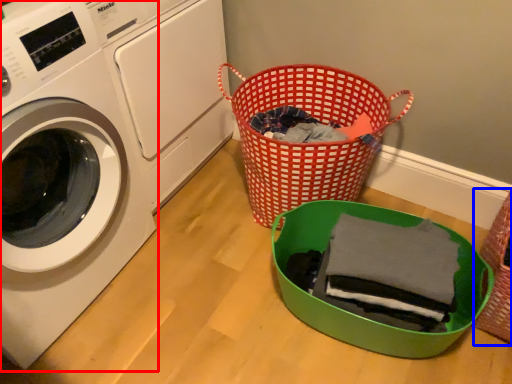
Question: Which object is closer to the camera taking this photo, washing machine (highlighted by a red box) or basket (highlighted by a blue box)?

Choices:
 (A) washing machine
 (B) basket

Answer: (A)